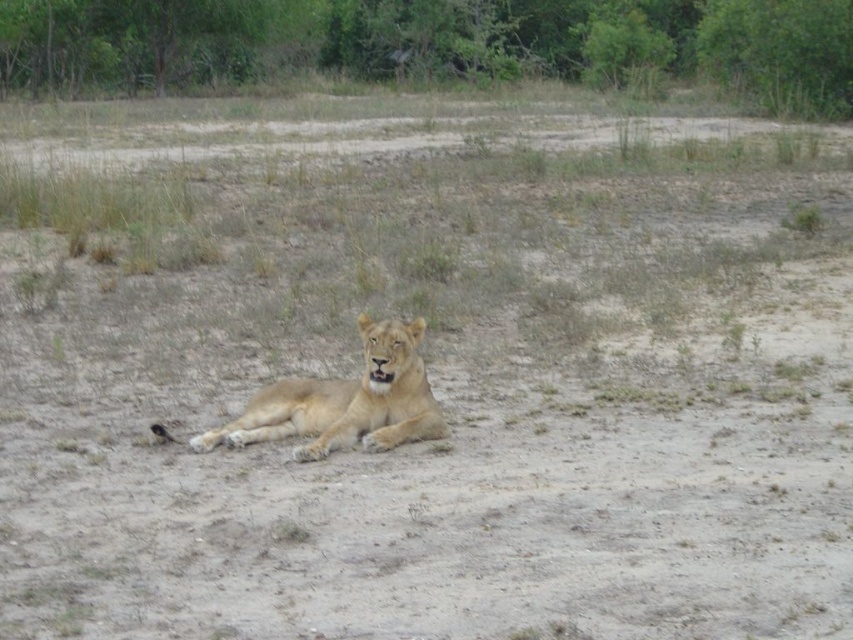
You are a wildlife photographer trying to capture the lioness resting on the dry terrain. You notice a point marked at coordinates (433, 44) in the image. What object is located at this point?

The point at coordinates (433, 44) indicates a green leafy tree at upper center.

You are a wildlife photographer standing in the savanna. You see the green leafy tree at upper center in the background. If you want to take a closeup photo of the tree, would you need to zoom in or zoom out your camera lens?

The green leafy tree at upper center is 90.20 feet away from the viewer. To take a closeup photo of the tree, you would need to zoom in your camera lens to capture the tree in detail from that distance.

You are a wildlife photographer trying to capture a photo of the golden fur lion at center. You notice a green leafy tree at upper center in the background. Will the tree appear in front of or behind the lion in your photo?

The green leafy tree at upper center is further to the viewer than golden fur lion at center, so the tree will appear in front of the lion in your photo.